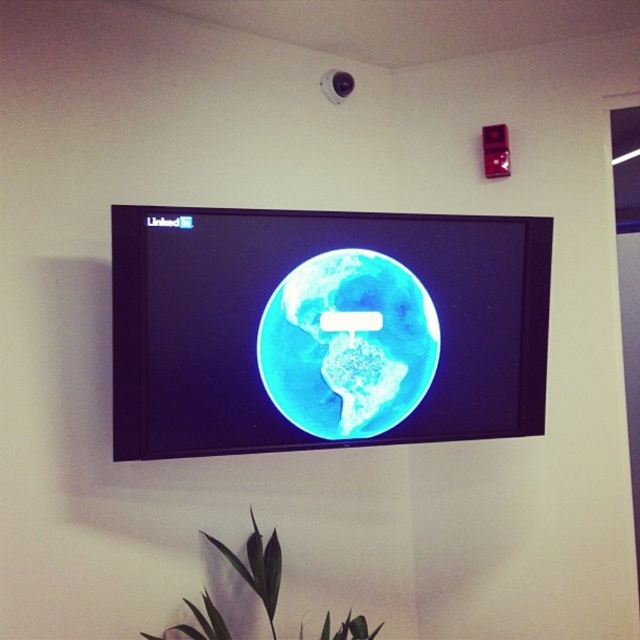
You are an interior designer planning to hang a new picture frame between the blue glossy globe at center and the green matte leaf at lower center. Since the picture frame is 10 inches wide, will it fit horizontally between these two objects?

The blue glossy globe at center is taller than the green matte leaf at lower center, but the description does not provide information about their horizontal distance. Therefore, it is impossible to determine if the picture frame will fit horizontally between them based on the given details.

You are standing in the room and want to place a small decorative item exactly at the point marked as point [289,449]. The security camera is mounted above the TV. Can you confirm if the distance between the point and the camera is within the recommended 6 feet safety zone for placing items?

The point [289,449] is 5.64 feet away from the camera, which is within the recommended 6 feet safety zone for placing items.

In the scene described, there is a wall with a flat screen TV showing two blue Earth images. The objects are the blue glossy globe at center and the blue matte earth at center. Which of these two objects is positioned to the left?

The blue glossy globe at center is positioned to the left of the blue matte earth at center.